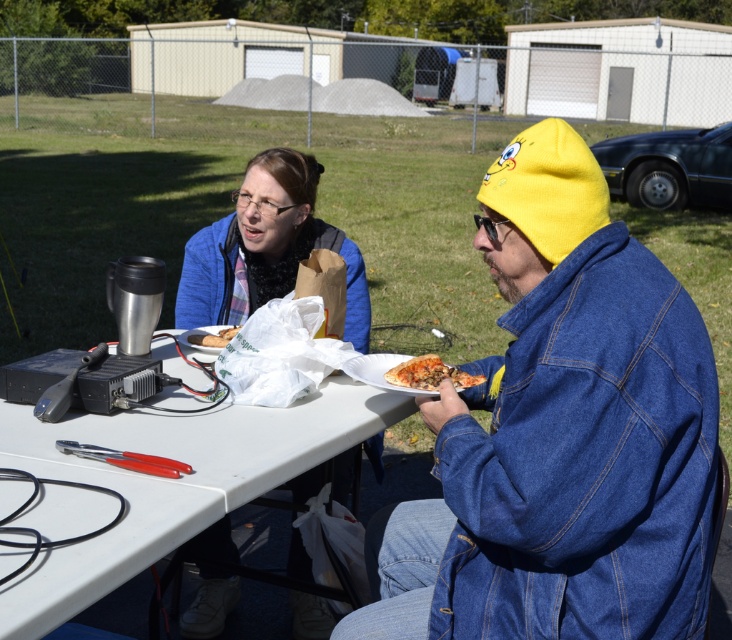
Question: Based on their relative distances, which object is farther from the matte plastic sandwich at center?

Choices:
 (A) blue fleece jacket at upper center
 (B) white plastic table at center
 (C) denim jacket at right
 (D) golden crispy pizza at lower center

Answer: (C)

Question: Is blue fleece jacket at upper center thinner than golden crispy pizza at lower center?

Choices:
 (A) no
 (B) yes

Answer: (A)

Question: Estimate the real-world distances between objects in this image. Which object is closer to the blue fleece jacket at upper center?

Choices:
 (A) white plastic table at center
 (B) denim jacket at right

Answer: (A)

Question: Does white plastic table at center come in front of blue fleece jacket at upper center?

Choices:
 (A) no
 (B) yes

Answer: (B)

Question: Can you confirm if denim jacket at right is smaller than golden crispy pizza at lower center?

Choices:
 (A) no
 (B) yes

Answer: (A)

Question: Among these points, which one is nearest to the camera?

Choices:
 (A) (163, 444)
 (B) (548, 161)
 (C) (197, 336)

Answer: (B)